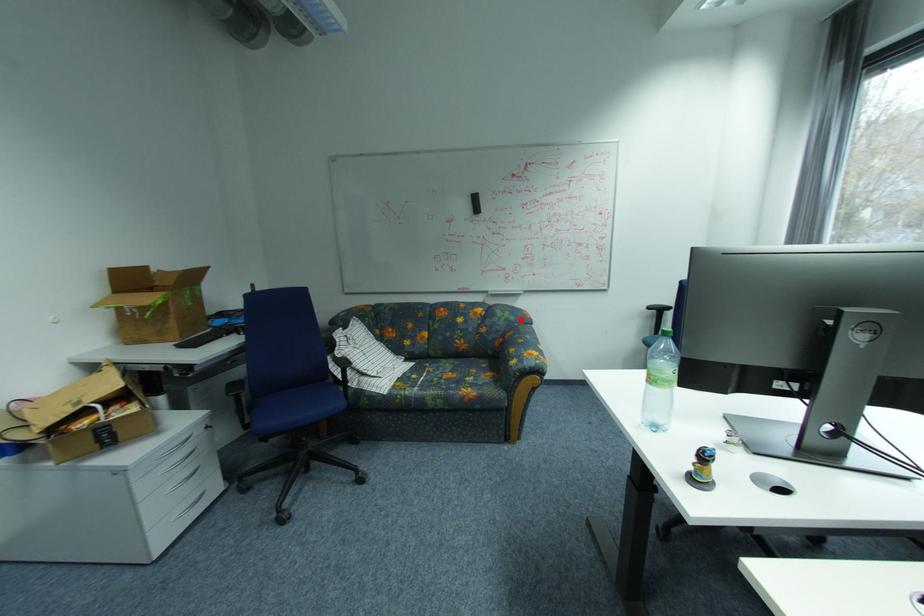
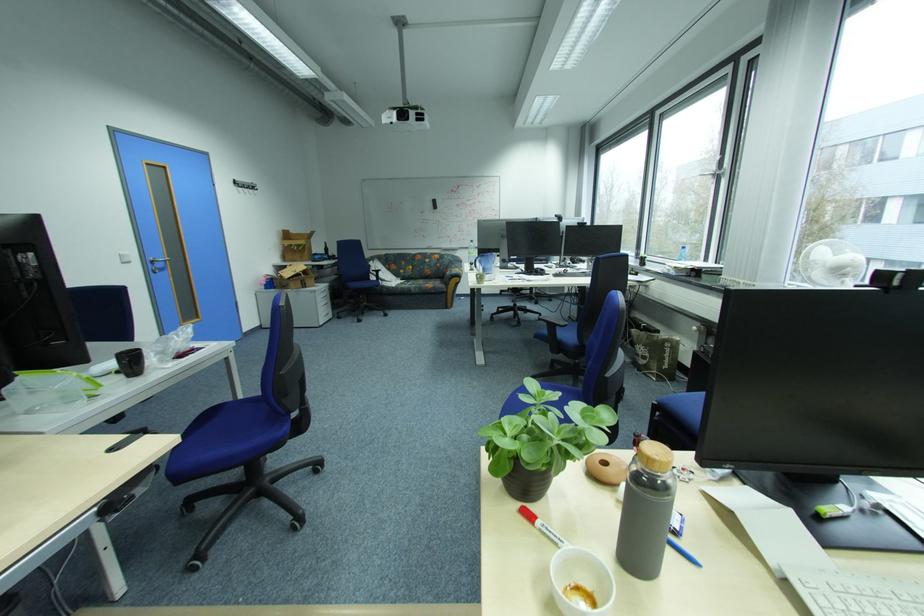
Question: I am providing you with two images of the same scene from different viewpoints. A red point is shown in image1. For the corresponding object point in image2, is it positioned nearer or farther from the camera?

Choices:
 (A) Nearer
 (B) Farther

Answer: (A)